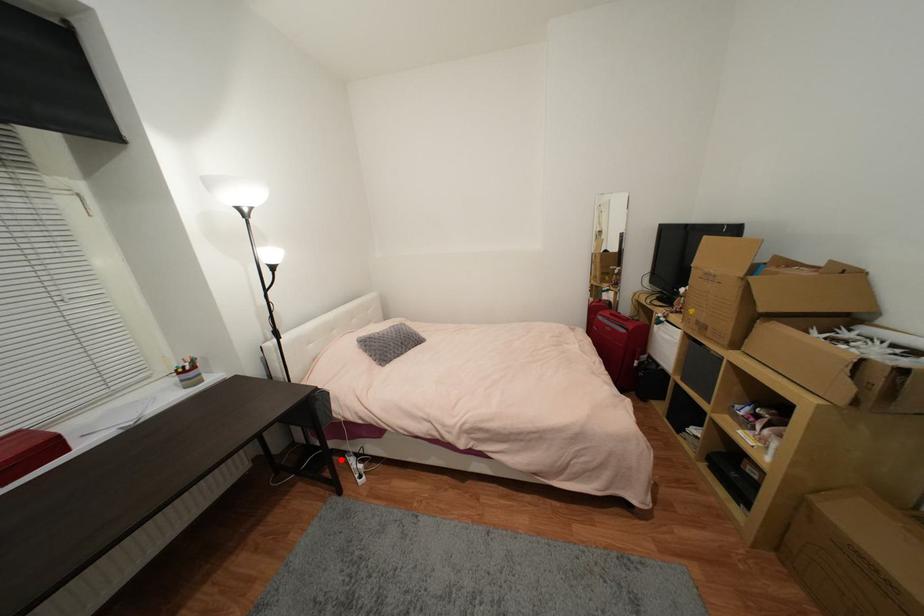
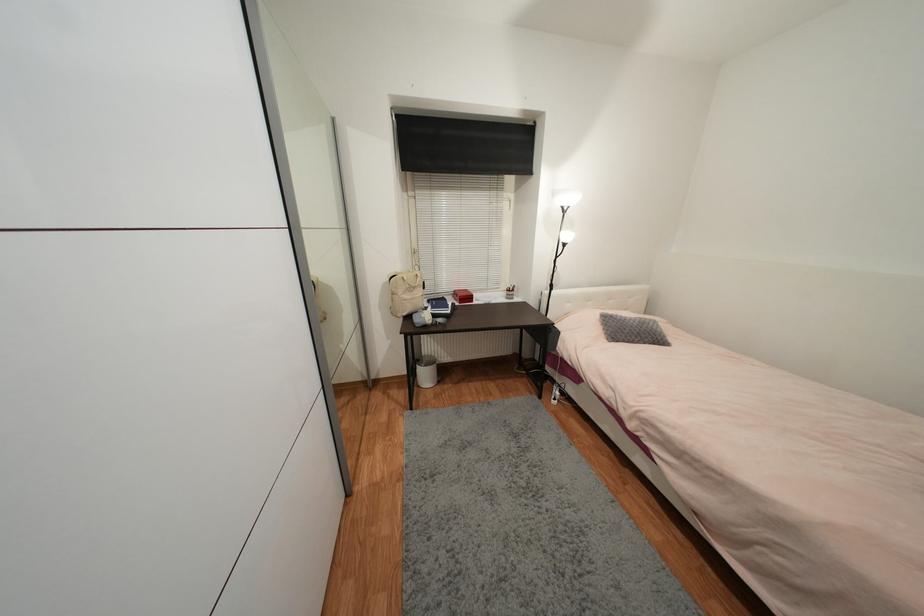
Question: I am providing you with two images of the same scene from different viewpoints. Image1 has a red point marked. In image2, the corresponding 3D location appears at what relative position? Reply with the corresponding letter.

Choices:
 (A) Closer
 (B) Farther

Answer: (A)